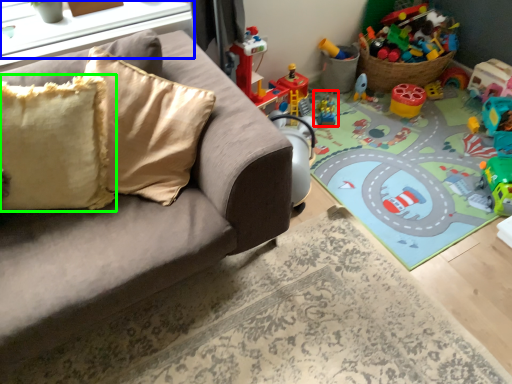
Question: Based on their relative distances, which object is nearer to toy (highlighted by a red box)? Choose from window sill (highlighted by a blue box) and pillow (highlighted by a green box).

Choices:
 (A) window sill
 (B) pillow

Answer: (A)